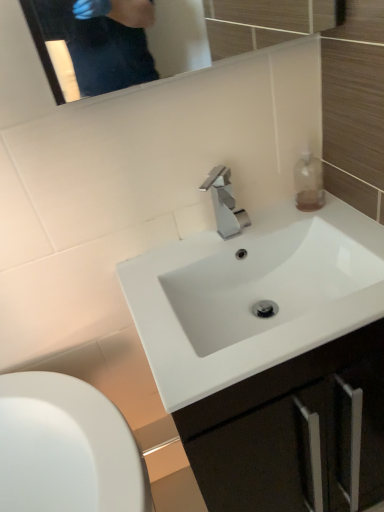
Question: From the image's perspective, is polished metallic faucet at center above white glossy sink at center, which ranks as the 2th sink in bottom-to-top order?

Choices:
 (A) yes
 (B) no

Answer: (A)

Question: Is polished metallic faucet at center turned away from white glossy sink at center, the first sink positioned from the top?

Choices:
 (A) yes
 (B) no

Answer: (B)

Question: From a real-world perspective, is polished metallic faucet at center located beneath white glossy sink at center, which ranks as the 2th sink in bottom-to-top order?

Choices:
 (A) no
 (B) yes

Answer: (A)

Question: Is polished metallic faucet at center facing towards white glossy sink at center, which ranks as the 2th sink in bottom-to-top order?

Choices:
 (A) yes
 (B) no

Answer: (B)

Question: From the image's perspective, is polished metallic faucet at center below white glossy sink at center, which ranks as the 2th sink in bottom-to-top order?

Choices:
 (A) no
 (B) yes

Answer: (A)

Question: Considering the relative sizes of polished metallic faucet at center and white glossy sink at center, the first sink positioned from the top, in the image provided, is polished metallic faucet at center bigger than white glossy sink at center, the first sink positioned from the top,?

Choices:
 (A) yes
 (B) no

Answer: (B)

Question: Is white glossy sink at center, the first sink when ordered from bottom to top, at the left side of polished metallic faucet at center?

Choices:
 (A) no
 (B) yes

Answer: (A)

Question: Is white glossy sink at center, the second sink viewed from the top, further to camera compared to polished metallic faucet at center?

Choices:
 (A) yes
 (B) no

Answer: (B)

Question: Is white glossy sink at center, the first sink when ordered from bottom to top, facing away from polished metallic faucet at center?

Choices:
 (A) yes
 (B) no

Answer: (B)

Question: Is white glossy sink at center, the first sink when ordered from bottom to top, aimed at polished metallic faucet at center?

Choices:
 (A) yes
 (B) no

Answer: (B)

Question: From the image's perspective, is white glossy sink at center, the first sink when ordered from bottom to top, below polished metallic faucet at center?

Choices:
 (A) no
 (B) yes

Answer: (B)

Question: Is polished metallic faucet at center located within white glossy sink at center, the second sink viewed from the top?

Choices:
 (A) yes
 (B) no

Answer: (B)

Question: Is the depth of white glossy sink at center, which ranks as the 2th sink in bottom-to-top order, less than that of polished metallic faucet at center?

Choices:
 (A) no
 (B) yes

Answer: (B)